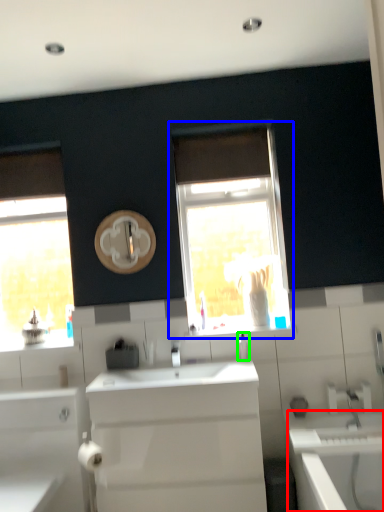
Question: Which object is positioned closest to bath (highlighted by a red box)? Select from window (highlighted by a blue box) and soap dispenser (highlighted by a green box).

Choices:
 (A) window
 (B) soap dispenser

Answer: (B)